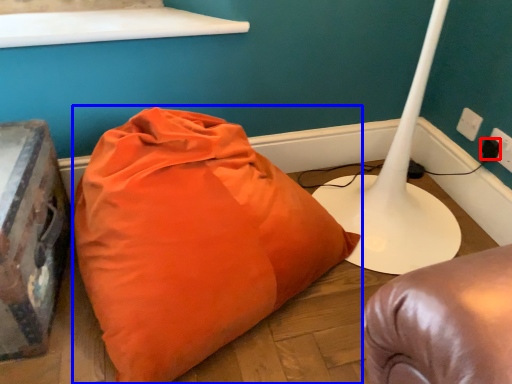
Question: Which object appears farthest to the camera in this image, plug (highlighted by a red box) or pillow (highlighted by a blue box)?

Choices:
 (A) plug
 (B) pillow

Answer: (A)